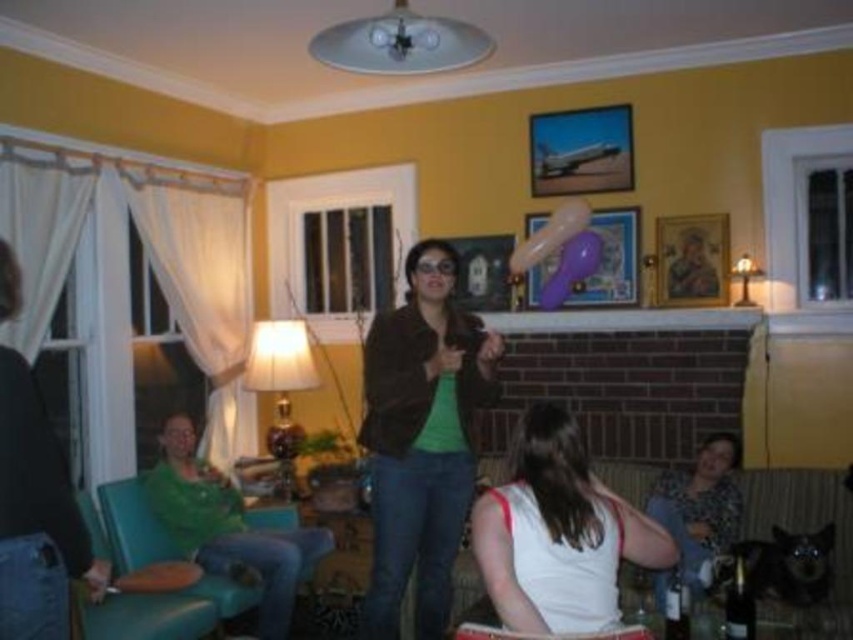
Question: Which point appears closest to the camera in this image?

Choices:
 (A) (686, 275)
 (B) (590, 573)

Answer: (B)

Question: Which point is closer to the camera taking this photo?

Choices:
 (A) (593, 536)
 (B) (6, 548)

Answer: (B)

Question: Is floral print dress at lower right smaller than wooden framed portrait at upper right?

Choices:
 (A) no
 (B) yes

Answer: (A)

Question: Which point is farther from the camera taking this photo?

Choices:
 (A) (606, 220)
 (B) (695, 262)

Answer: (A)

Question: Considering the relative positions of matte brown jacket at center and floral print dress at lower right in the image provided, where is matte brown jacket at center located with respect to floral print dress at lower right?

Choices:
 (A) below
 (B) above

Answer: (B)

Question: From the image, what is the correct spatial relationship of wooden framed portrait at upper right in relation to matte plastic picture frame at upper center?

Choices:
 (A) right
 (B) left

Answer: (A)